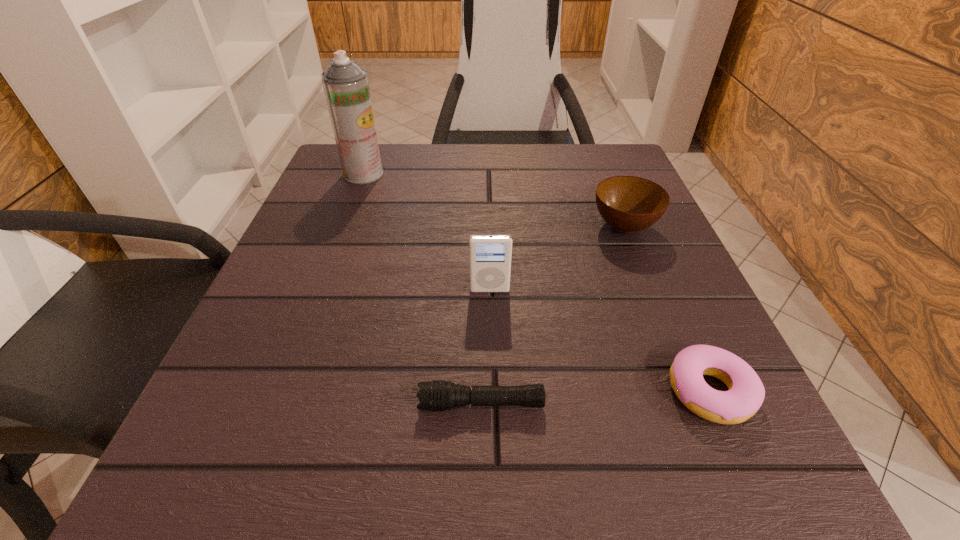
Locate an element on the screen. The height and width of the screenshot is (540, 960). vacant point at the far edge is located at coordinates (489, 182).

This screenshot has width=960, height=540. What are the coordinates of `vacant space at the near edge of the desktop` in the screenshot? It's located at (513, 488).

At what (x,y) coordinates should I click in order to perform the action: click on vacant region at the left edge of the desktop. Please return your answer as a coordinate pair (x, y). The height and width of the screenshot is (540, 960). Looking at the image, I should click on (327, 266).

At what (x,y) coordinates should I click in order to perform the action: click on vacant space at the right edge of the desktop. Please return your answer as a coordinate pair (x, y). This screenshot has height=540, width=960. Looking at the image, I should click on (630, 279).

This screenshot has width=960, height=540. In the image, there is a desktop. Identify the location of vacant space at the far left corner. (314, 192).

Locate an element on the screen. Image resolution: width=960 pixels, height=540 pixels. vacant space at the far right corner is located at coordinates (568, 144).

At what (x,y) coordinates should I click in order to perform the action: click on blank region between the fourth nearest object and the third nearest object. Please return your answer as a coordinate pair (x, y). Looking at the image, I should click on (557, 258).

Image resolution: width=960 pixels, height=540 pixels. In order to click on vacant space in between the tallest object and the iPod in this screenshot , I will do `click(426, 232)`.

Identify the location of free point between the tallest object and the bowl. (493, 200).

Where is `vacant space that's between the flashlight and the doughnut`? This screenshot has width=960, height=540. vacant space that's between the flashlight and the doughnut is located at coordinates (596, 397).